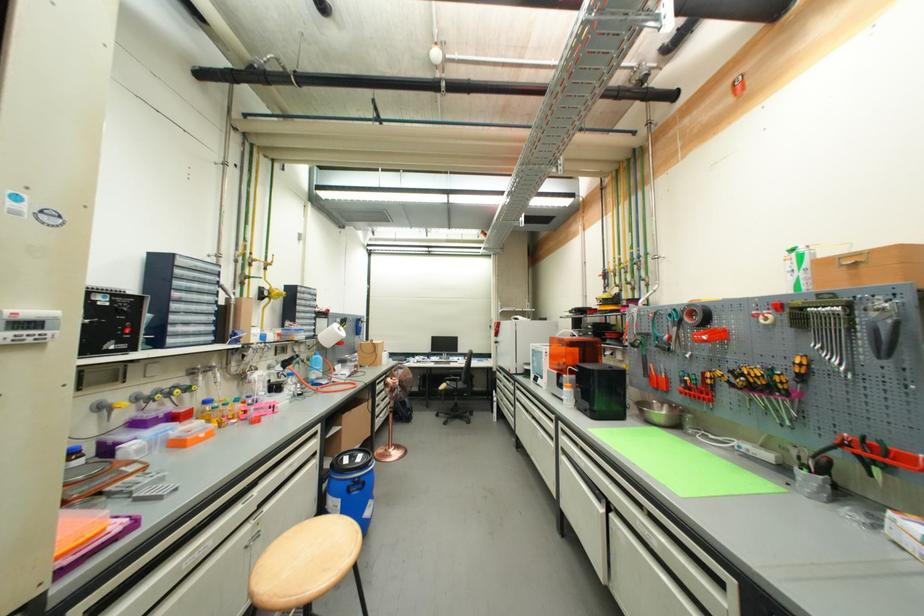
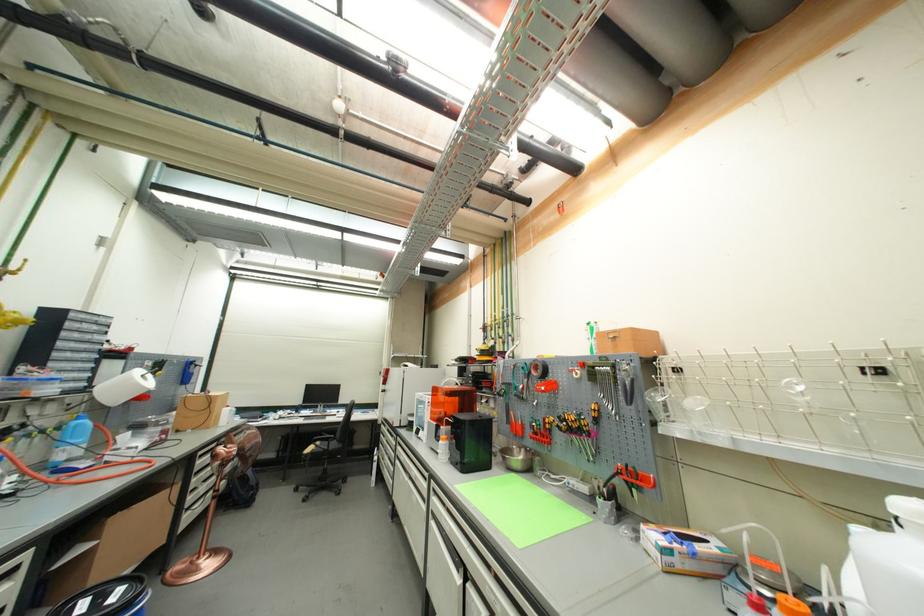
The point at (x=792, y=390) is marked in the first image. Where is the corresponding point in the second image?

(592, 431)